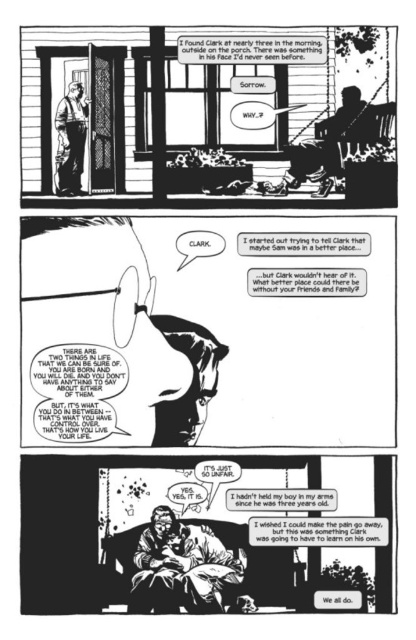
Looking at this image, measure the distance from smooth glass eye at center to matte black baby at center.

The distance of smooth glass eye at center from matte black baby at center is 20.03 centimeters.

Between point (116, 307) and point (131, 596), which one is positioned behind?

Positioned behind is point (116, 307).

Identify the location of smooth glass eye at center. (106, 340).